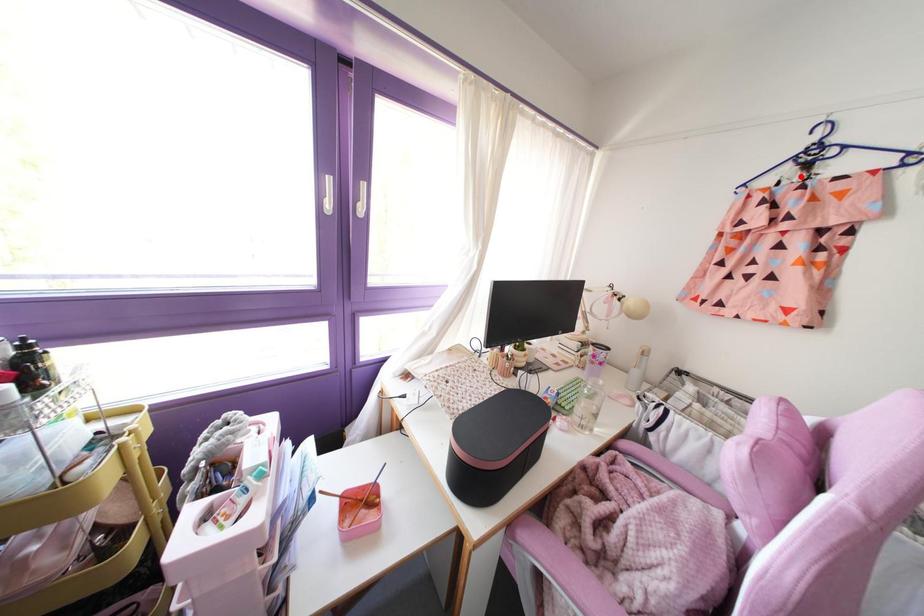
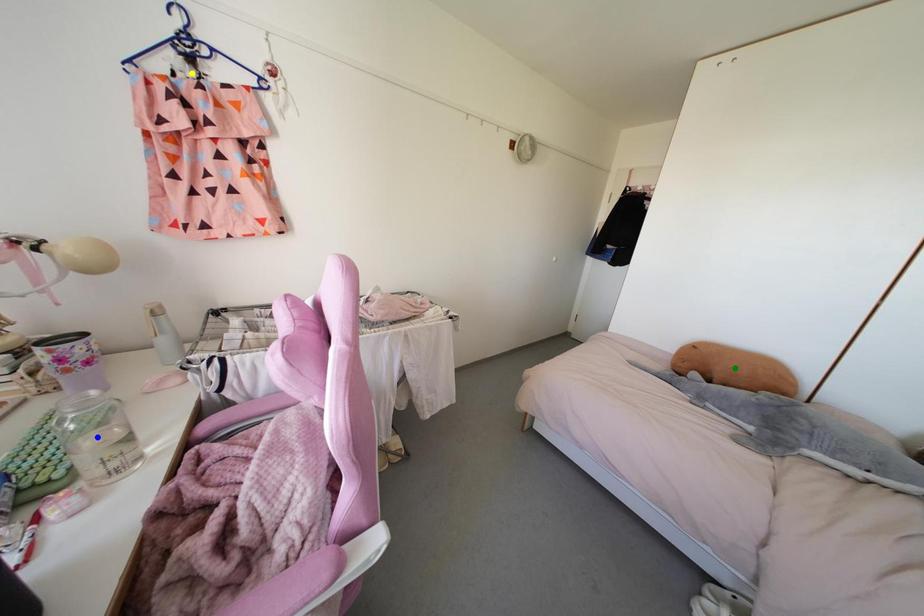
Question: I am providing you with two images of the same scene from different viewpoints. A red point is marked on the first image. You are given multiple points on the second image. Can you choose the point in image 2 that corresponds to the point in image 1?

Choices:
 (A) yellow point
 (B) blue point
 (C) green point

Answer: (A)